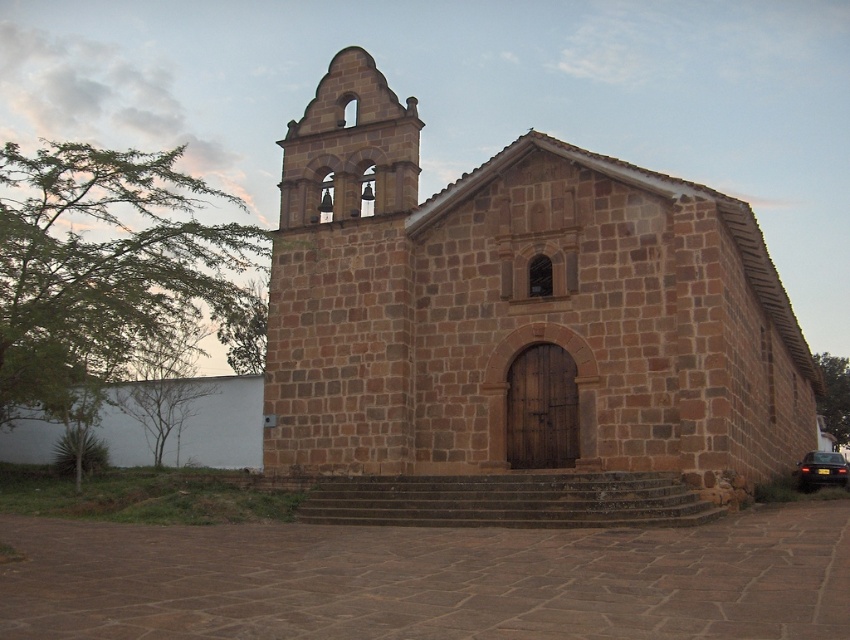
Which is behind, point (299, 296) or point (411, 200)?

The point (299, 296) is more distant.

Which of these two, brown stone church at center or brown stone bell tower at upper left, stands shorter?

With less height is brown stone bell tower at upper left.

Locate an element on the screen. Image resolution: width=850 pixels, height=640 pixels. brown stone church at center is located at coordinates (516, 332).